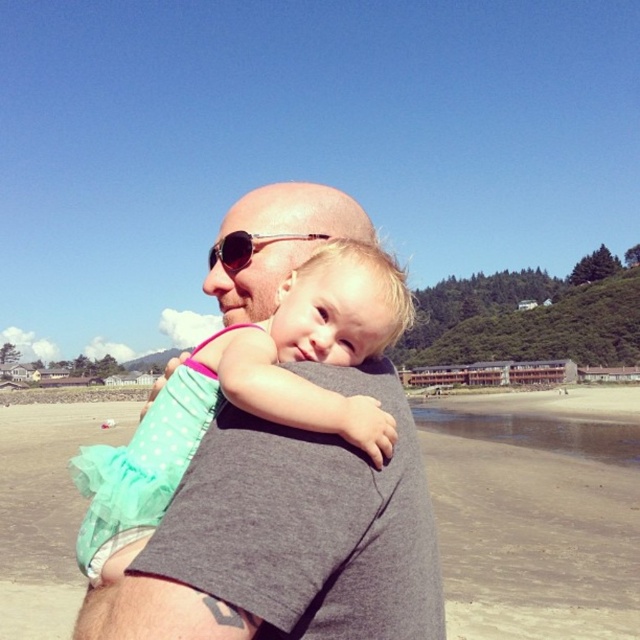
You are a photographer trying to capture a candid shot of the man and child without them noticing. Since you want to avoid reflecting your camera in their metallic gold sunglasses at center, where should you position yourself relative to the smooth sand at center?

The smooth sand at center is positioned under metallic gold sunglasses at center, so to avoid reflecting your camera in the metallic gold sunglasses at center, you should position yourself behind the smooth sand at center where the sunglasses cannot see you.

You are planning to place a small seashell on the smooth sand at center. Can you determine if the metallic gold sunglasses at center would completely cover the seashell if placed on top?

The smooth sand at center has a larger size compared to metallic gold sunglasses at center. Since the sunglasses are smaller, they would not completely cover the seashell placed on the sand.